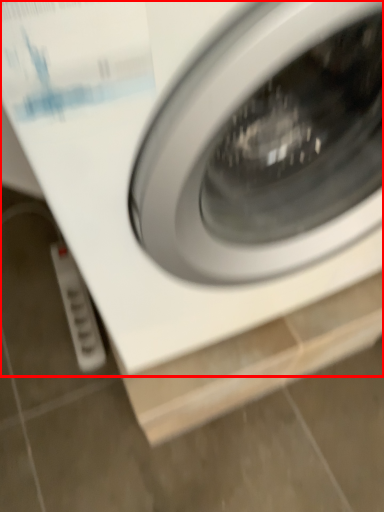
Question: Observing the image, what is the correct spatial positioning of washing machine (annotated by the red box) in reference to electric outlet?

Choices:
 (A) right
 (B) left

Answer: (A)